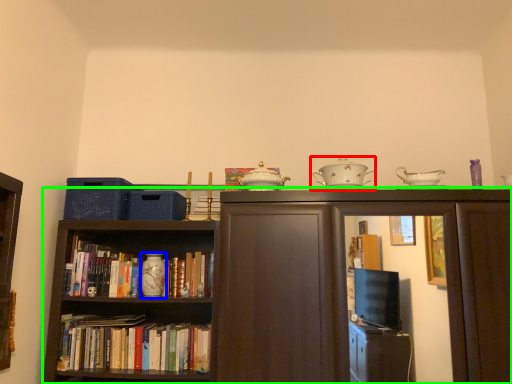
Question: Which is nearer to the tableware (highlighted by a red box)? tableware (highlighted by a blue box) or bookcase (highlighted by a green box).

Choices:
 (A) tableware
 (B) bookcase

Answer: (B)